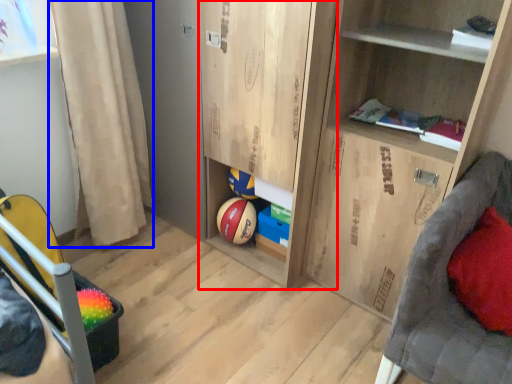
Question: Which of the following is the farthest to the observer, cabinet (highlighted by a red box) or curtain (highlighted by a blue box)?

Choices:
 (A) cabinet
 (B) curtain

Answer: (B)